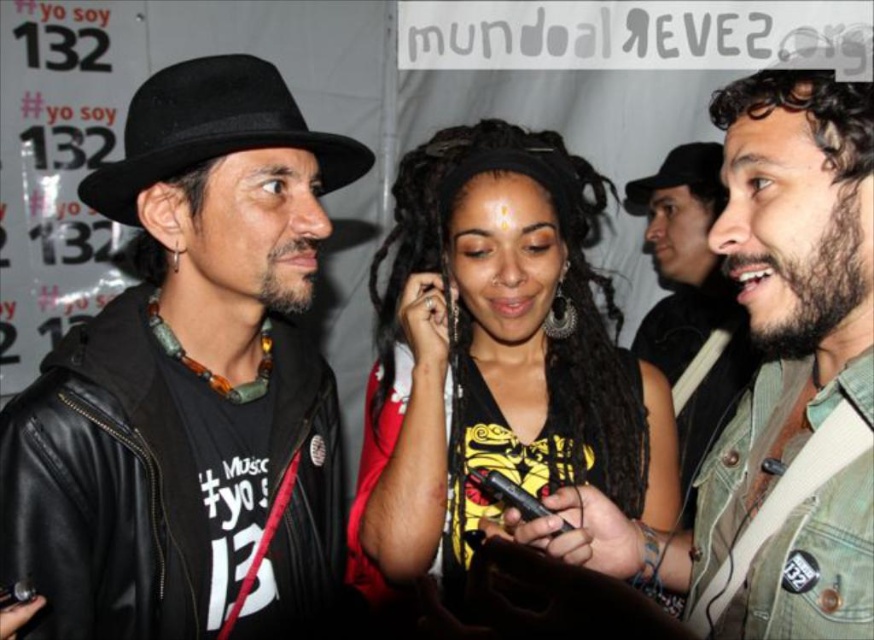
Between point (764, 538) and point (642, 211), which one is positioned in front?

Point (764, 538) is in front.

Identify the location of beige denim jacket at center. The height and width of the screenshot is (640, 874). (773, 385).

You are a GUI agent. You are given a task and a screenshot of the screen. Output one action in this format:
    pyautogui.click(x=<x>, y=<y>)
    Task: Click on the beige denim jacket at center
    
    Given the screenshot: What is the action you would take?
    pyautogui.click(x=773, y=385)

Does point (37, 388) lie in front of point (424, 326)?

Yes.

Can you confirm if black leather hat at upper left is taller than black matte hair at center?

Yes.

Locate an element on the screen. The image size is (874, 640). black leather hat at upper left is located at coordinates (191, 385).

Locate an element on the screen. Image resolution: width=874 pixels, height=640 pixels. black leather hat at upper left is located at coordinates (191, 385).

Is black felt fedora at left to the right of black felt fedora at upper center from the viewer's perspective?

In fact, black felt fedora at left is to the left of black felt fedora at upper center.

Does black felt fedora at left come in front of black felt fedora at upper center?

Yes, black felt fedora at left is in front of black felt fedora at upper center.

The width and height of the screenshot is (874, 640). I want to click on black felt fedora at left, so click(x=212, y=131).